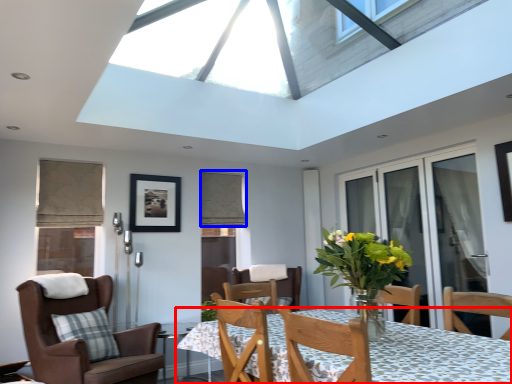
Question: Which object appears closest to the camera in this image, table (highlighted by a red box) or curtain (highlighted by a blue box)?

Choices:
 (A) table
 (B) curtain

Answer: (A)